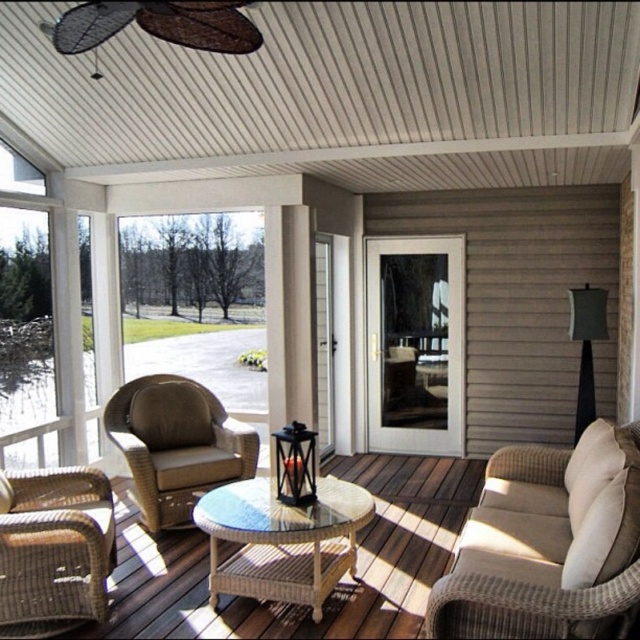
Question: Which object is closer to the camera taking this photo?

Choices:
 (A) woven rattan chair at lower left
 (B) woven rattan coffee table at center

Answer: (A)

Question: Which of the following is the farthest from the observer?

Choices:
 (A) (228, 433)
 (B) (326, 401)

Answer: (B)

Question: Which of the following is the closest to the observer?

Choices:
 (A) woven rattan couch at center
 (B) clear glass door at center
 (C) woven rattan coffee table at center
 (D) woven rattan chair at lower left

Answer: (D)

Question: Does woven rattan couch at center have a larger size compared to brown wicker rocking chair at left?

Choices:
 (A) yes
 (B) no

Answer: (A)

Question: Is beige woven armchair at lower right below clear glass screen door at center?

Choices:
 (A) yes
 (B) no

Answer: (A)

Question: Can you confirm if beige woven armchair at lower right is bigger than clear glass door at center?

Choices:
 (A) yes
 (B) no

Answer: (A)